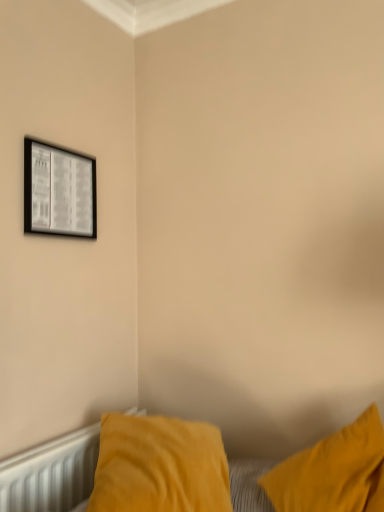
Question: Is white textured radiator at lower left to the left of velvet yellow pillow at lower right from the viewer's perspective?

Choices:
 (A) no
 (B) yes

Answer: (B)

Question: From the image's perspective, is white textured radiator at lower left beneath velvet yellow pillow at lower right?

Choices:
 (A) no
 (B) yes

Answer: (B)

Question: From a real-world perspective, is white textured radiator at lower left physically below velvet yellow pillow at lower right?

Choices:
 (A) yes
 (B) no

Answer: (A)

Question: Is white textured radiator at lower left facing towards velvet yellow pillow at lower right?

Choices:
 (A) no
 (B) yes

Answer: (B)

Question: Considering the relative sizes of white textured radiator at lower left and velvet yellow pillow at lower right in the image provided, is white textured radiator at lower left thinner than velvet yellow pillow at lower right?

Choices:
 (A) yes
 (B) no

Answer: (A)

Question: Does white textured radiator at lower left have a smaller size compared to velvet yellow pillow at lower right?

Choices:
 (A) no
 (B) yes

Answer: (B)

Question: Is black glossy picture frame at upper left turned away from white textured radiator at lower left?

Choices:
 (A) no
 (B) yes

Answer: (A)

Question: Is black glossy picture frame at upper left far away from white textured radiator at lower left?

Choices:
 (A) no
 (B) yes

Answer: (A)

Question: Is black glossy picture frame at upper left thinner than white textured radiator at lower left?

Choices:
 (A) no
 (B) yes

Answer: (B)

Question: Does black glossy picture frame at upper left have a greater width compared to white textured radiator at lower left?

Choices:
 (A) yes
 (B) no

Answer: (B)

Question: From the image's perspective, is black glossy picture frame at upper left above white textured radiator at lower left?

Choices:
 (A) yes
 (B) no

Answer: (A)

Question: Could you tell me if black glossy picture frame at upper left is turned towards white textured radiator at lower left?

Choices:
 (A) yes
 (B) no

Answer: (B)

Question: Is velvet yellow pillow at lower right at the right side of black glossy picture frame at upper left?

Choices:
 (A) no
 (B) yes

Answer: (B)